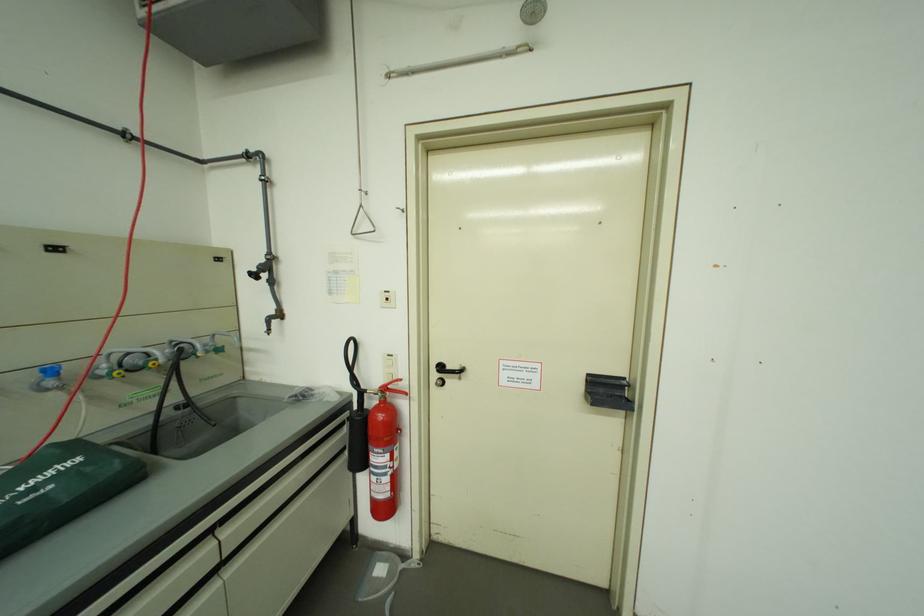
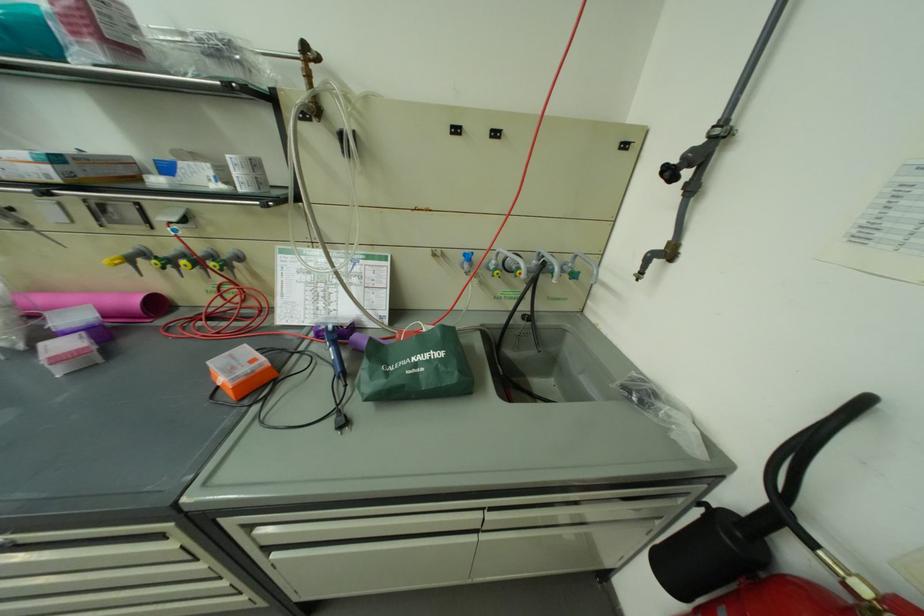
How did the camera likely rotate?

The rotation direction of the camera is left-down.